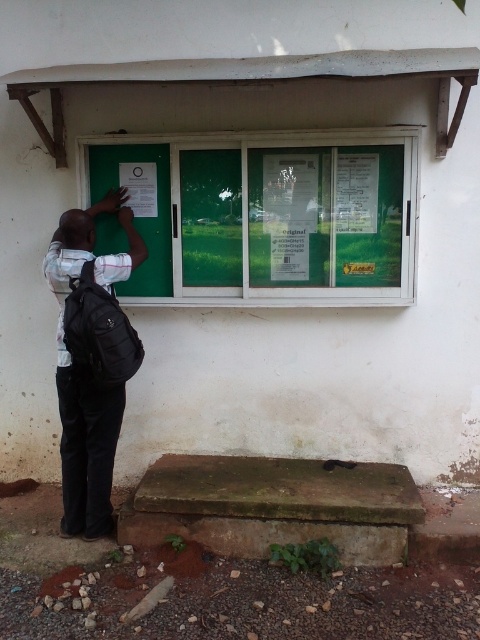
Can you confirm if green glass window at center is shorter than black backpack at left?

Yes, green glass window at center is shorter than black backpack at left.

Is green glass window at center below black backpack at left?

No, green glass window at center is not below black backpack at left.

Which is behind, point (346, 300) or point (72, 321)?

Point (346, 300)

Image resolution: width=480 pixels, height=640 pixels. I want to click on green glass window at center, so (x=266, y=216).